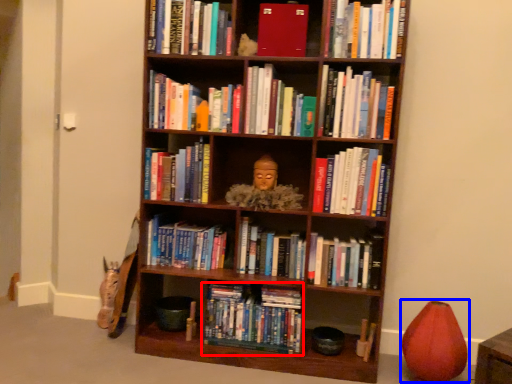
Question: Which object appears closest to the camera in this image, book (highlighted by a red box) or toy (highlighted by a blue box)?

Choices:
 (A) book
 (B) toy

Answer: (B)